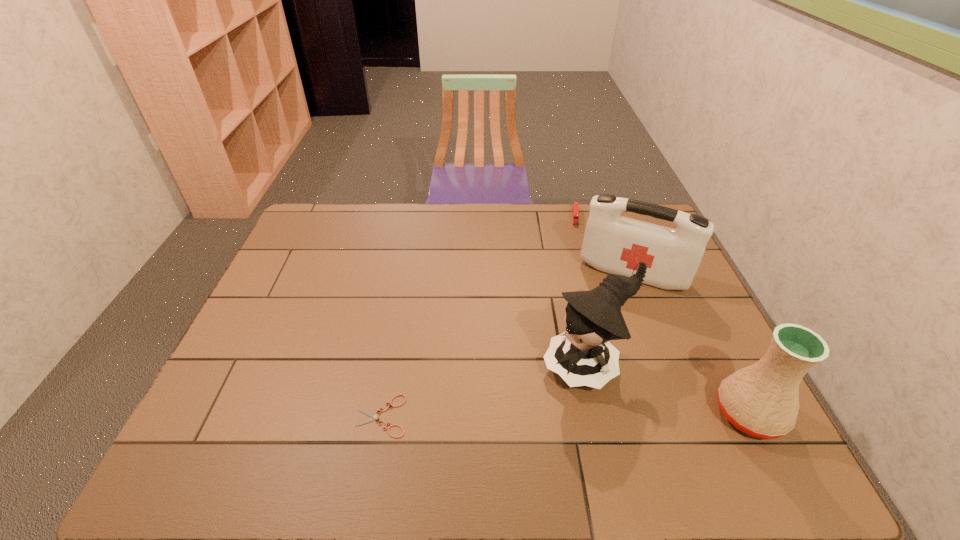
Locate an element on the screen. This screenshot has width=960, height=540. vacant space on the desktop that is between the leftmost object and the pottery and is positioned on the front-facing side of the stapler is located at coordinates (576, 415).

Find the location of a particular element. This screenshot has height=540, width=960. vacant space on the desktop that is between the shears and the pottery and is positioned on the front side of the fourth nearest object is located at coordinates (583, 415).

The image size is (960, 540). I want to click on free space on the desktop that is between the shears and the pottery and is positioned at the face of the doll, so click(x=516, y=415).